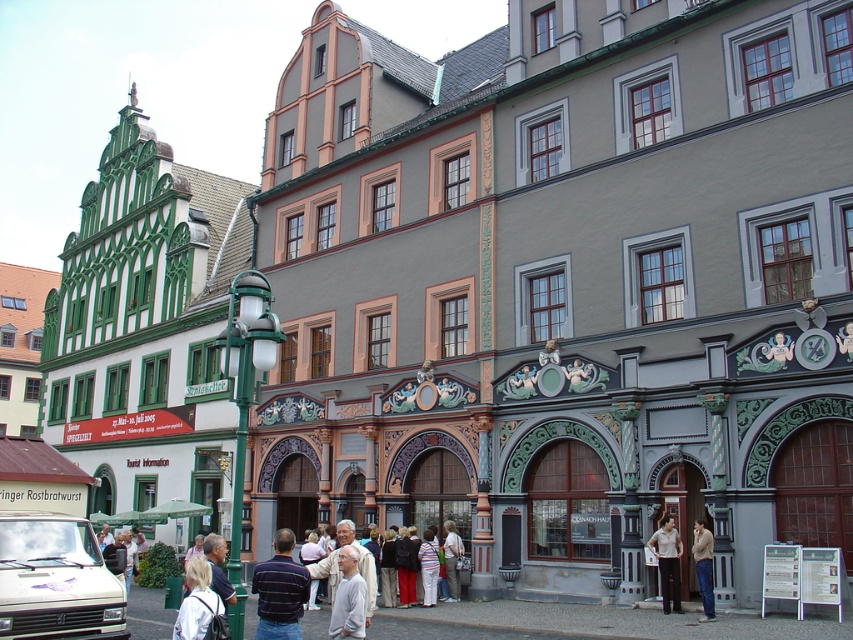
Which is above, striped cotton shirt at center or denim jeans at lower right?

denim jeans at lower right is above.

Is striped cotton shirt at center bigger than denim jeans at lower right?

Correct, striped cotton shirt at center is larger in size than denim jeans at lower right.

The image size is (853, 640). Find the location of `striped cotton shirt at center`. striped cotton shirt at center is located at coordinates (280, 589).

Is white matte van at lower left to the left of light brown leather pants at lower center from the viewer's perspective?

Yes, white matte van at lower left is to the left of light brown leather pants at lower center.

Does point (85, 621) lie in front of point (663, 604)?

That is True.

What are the coordinates of `white matte van at lower left` in the screenshot? It's located at (55, 579).

Is light brown leather pants at lower center positioned at the back of light beige fabric jacket at center?

No, it is not.

Which of these two, light brown leather pants at lower center or light beige fabric jacket at center, stands shorter?

light beige fabric jacket at center is shorter.

Does point (650, 544) come behind point (457, 548)?

No, it is not.

This screenshot has width=853, height=640. What are the coordinates of `light brown leather pants at lower center` in the screenshot? It's located at (666, 561).